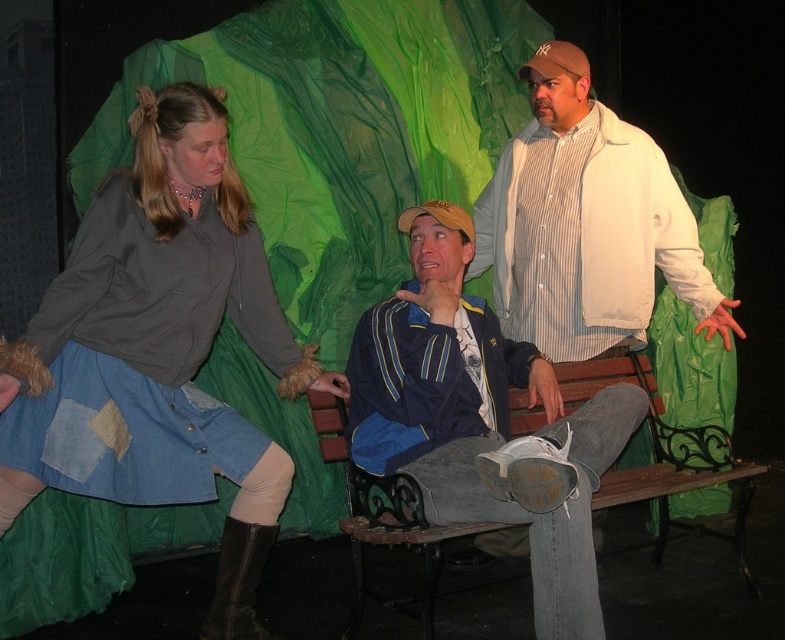
You are an audience member sitting in the front row of the theater. You notice the denim skirt at left and the white striped shirt at upper center. Which one is closer to the front of the stage?

The denim skirt at left is positioned under the white striped shirt at upper center, so the denim skirt at left is closer to the front of the stage.

You are a stagehand measuring the distance between the denim skirt at left and the white striped shirt at upper center for a scene change. The minimum required distance for safe passage is 4 feet. Can the current distance accommodate this requirement?

The distance between the denim skirt at left and the white striped shirt at upper center is 4.29 feet, which exceeds the minimum required 4 feet, so the current distance can accommodate the requirement.

You are a stagehand standing behind the camera. You need to place a 1.5 meter long banner between the denim skirt at left and the camera. Is there enough space?

The distance between the denim skirt at left and the camera is 2.06 meters, so yes, the banner can be placed since it is shorter than the available space.